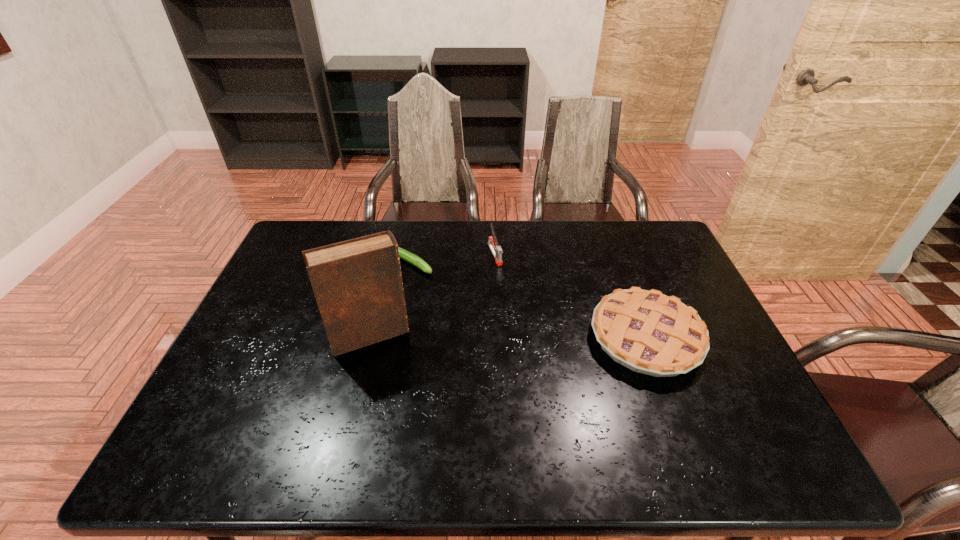
Locate which object is the closest to the shortest object. Please provide its 2D coordinates. Your answer should be formatted as a tuple, i.e. [(x, y)], where the tuple contains the x and y coordinates of a point satisfying the conditions above.

[(357, 283)]

Image resolution: width=960 pixels, height=540 pixels. I want to click on free space that satisfies the following two spatial constraints: 1. on the back side of the zucchini; 2. on the left side of the tallest object, so click(388, 262).

The image size is (960, 540). Find the location of `vacant region that satisfies the following two spatial constraints: 1. on the front side of the stapler; 2. on the left side of the third tallest object`. vacant region that satisfies the following two spatial constraints: 1. on the front side of the stapler; 2. on the left side of the third tallest object is located at coordinates (498, 338).

You are a GUI agent. You are given a task and a screenshot of the screen. Output one action in this format:
    pyautogui.click(x=<x>, y=<y>)
    Task: Click on the free space that satisfies the following two spatial constraints: 1. on the front side of the second shortest object; 2. on the right side of the shortest object
    This screenshot has height=540, width=960.
    Given the screenshot: What is the action you would take?
    pyautogui.click(x=389, y=338)